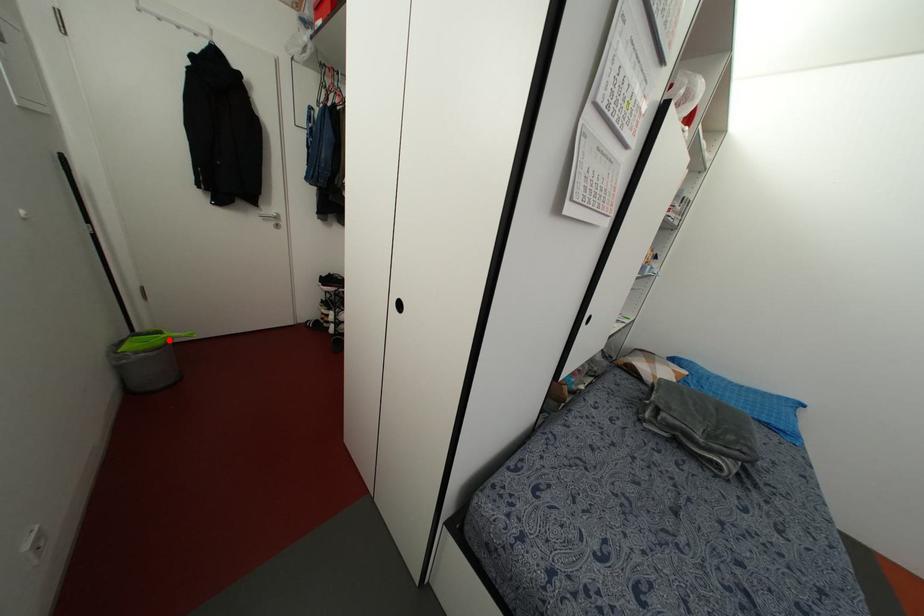
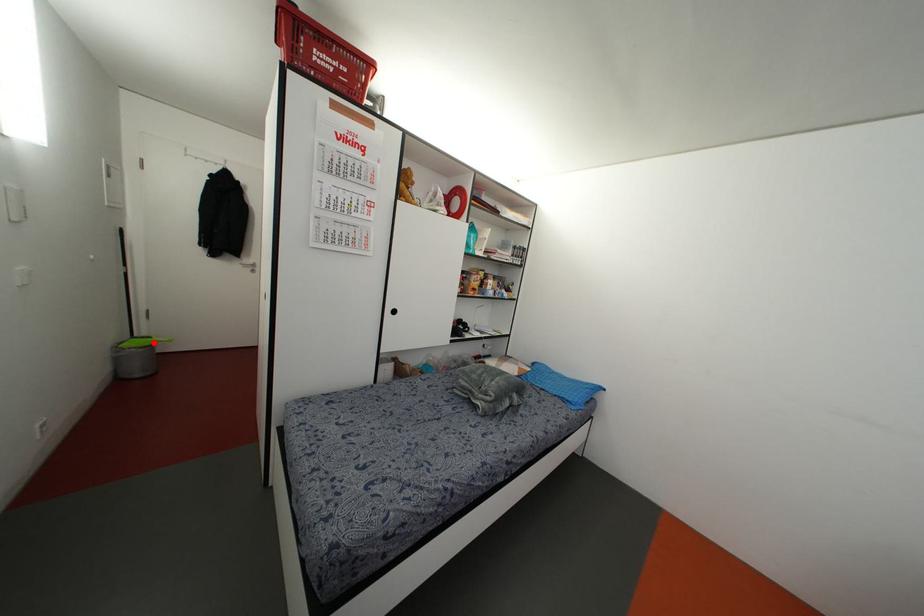
I am providing you with two images of the same scene from different viewpoints. A red point is marked on the first image and another point is marked on the second image. Do the highlighted points in image1 and image2 indicate the same real-world spot?

Yes